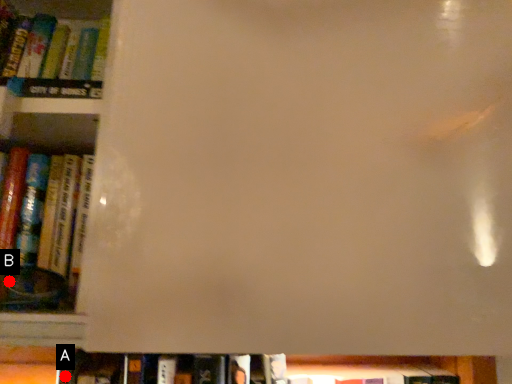
Question: Two points are circled on the image, labeled by A and B beside each circle. Which point appears farthest from the camera in this image?

Choices:
 (A) A is further
 (B) B is further

Answer: (A)